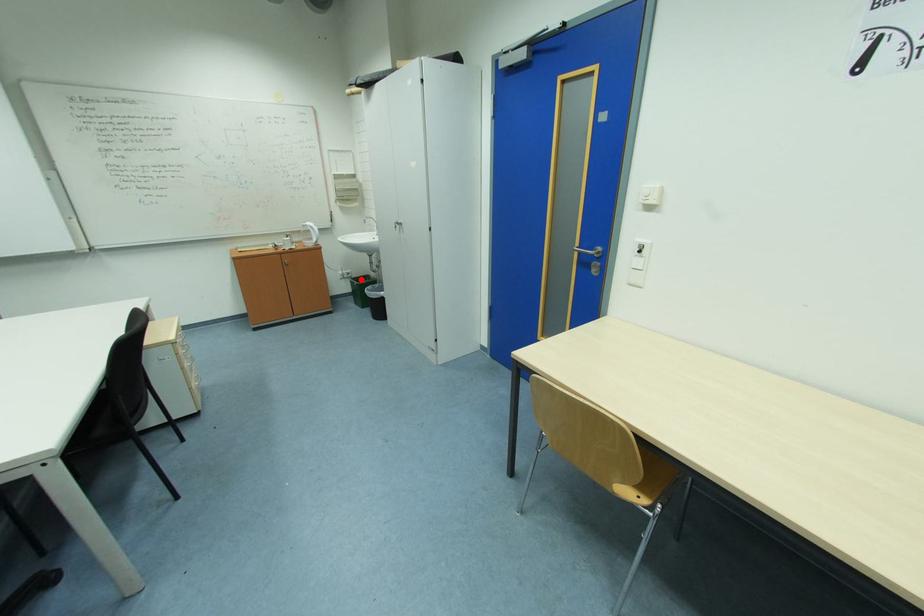
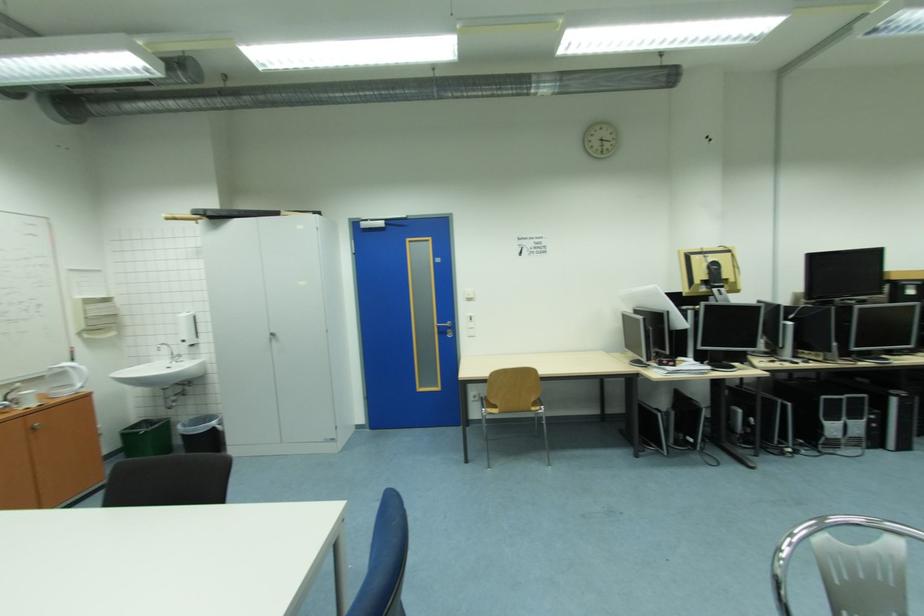
Question: I am providing you with two images of the same scene from different viewpoints. In image1, a red point is highlighted. Considering the same 3D point in image2, which of the following is correct?

Choices:
 (A) It is closer
 (B) It is farther

Answer: (B)